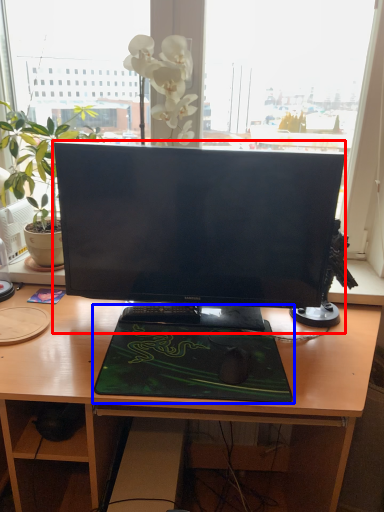
Question: Which object appears farthest to the camera in this image, computer monitor (highlighted by a red box) or desktop (highlighted by a blue box)?

Choices:
 (A) computer monitor
 (B) desktop

Answer: (A)